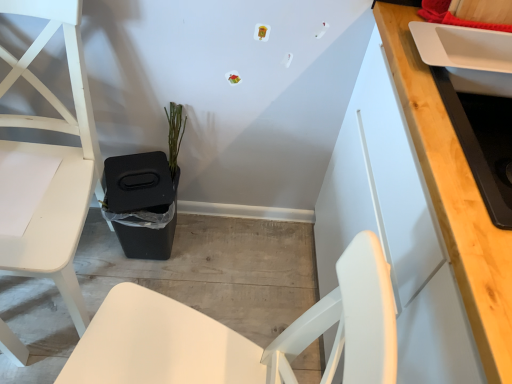
Question: In terms of size, does white matte chair at left appear bigger or smaller than white glossy sink at upper right?

Choices:
 (A) small
 (B) big

Answer: (B)

Question: Do you think white matte chair at left is within white glossy sink at upper right, or outside of it?

Choices:
 (A) inside
 (B) outside

Answer: (B)

Question: Which of these objects is positioned farthest from the white matte chair at left?

Choices:
 (A) white glossy sink at upper right
 (B) green matte plant at center

Answer: (A)

Question: Which object is the closest to the white glossy sink at upper right?

Choices:
 (A) green matte plant at center
 (B) white matte chair at left

Answer: (A)